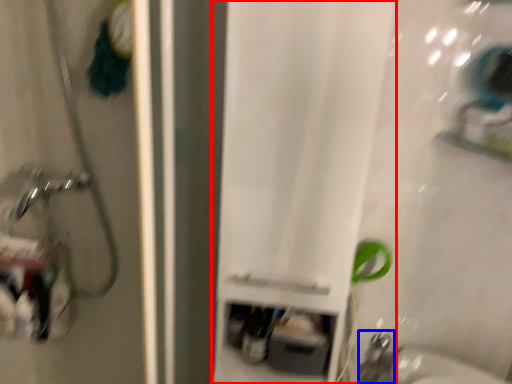
Question: Which point is closer to the camera, curtain (highlighted by a red box) or faucet (highlighted by a blue box)?

Choices:
 (A) curtain
 (B) faucet

Answer: (A)